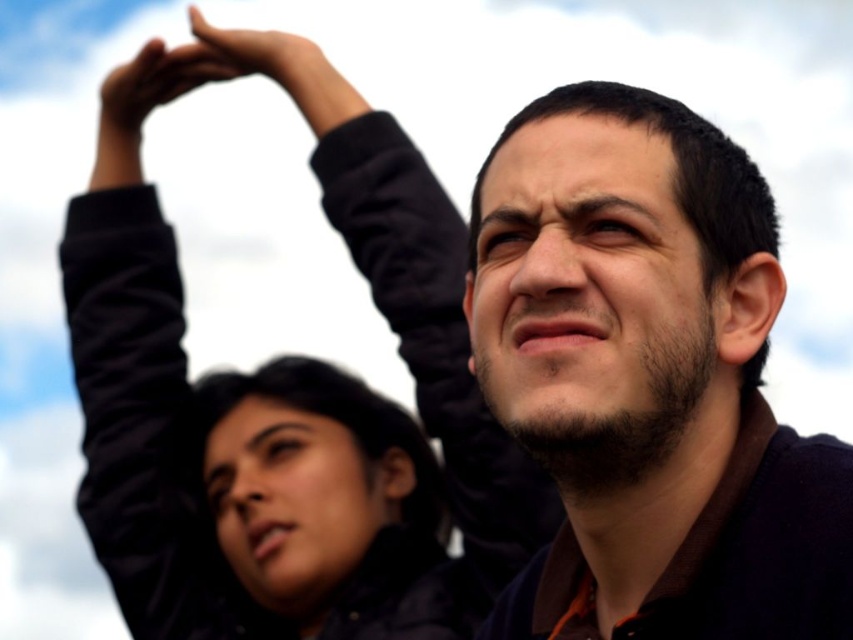
Based on the photo, you are a photographer trying to capture a candid shot of both the dark brown sweater at upper right and the black fabric arm at upper left in the same frame. Given their distance, will you need to adjust your camera settings to include both in the shot?

The dark brown sweater at upper right and the black fabric arm at upper left are 4.42 meters apart from each other. To capture both in the same frame, you would need to adjust your camera to a wider angle or move closer to ensure both are within the shot.

You are a photographer trying to capture a candid shot of the two people in the scene. You need to ensure that the dark brown sweater at upper right and the matte black hand at upper left are both visible in the frame. Based on their positions, which object should you focus on first to ensure both are in the shot?

The dark brown sweater at upper right is taller than the matte black hand at upper left, so focusing on the taller sweater first will ensure the hand is also in the frame.

Based on the scene description, can you determine which object is closer to the observer between the matte black jacket at upper center and the matte black hand at upper center?

The matte black jacket at upper center is in front of the matte black hand at upper center, so the matte black jacket at upper center is closer to the observer.